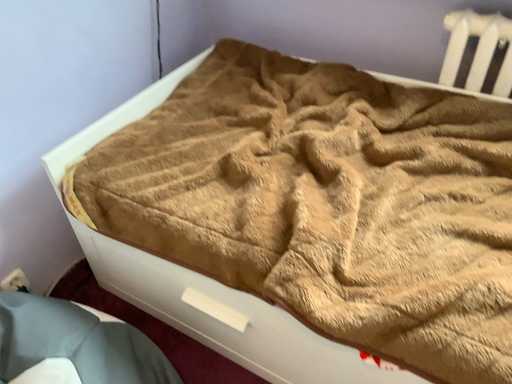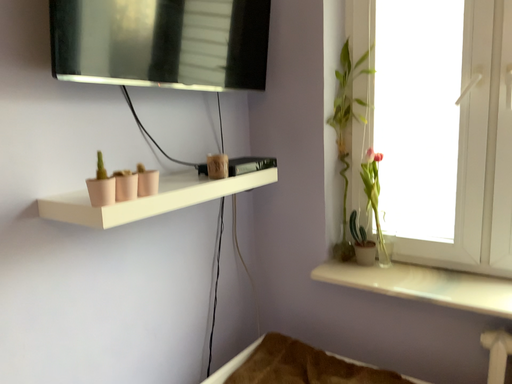
Question: Which way did the camera rotate in the video?

Choices:
 (A) rotated upward
 (B) rotated downward

Answer: (A)